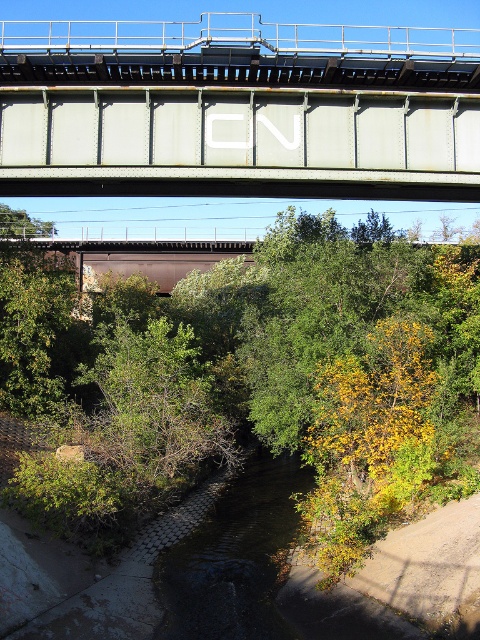
Question: Is green leafy tree at center below rusty metal bridge at upper center?

Choices:
 (A) no
 (B) yes

Answer: (B)

Question: Which of the following is the closest to the observer?

Choices:
 (A) (183, 364)
 (B) (31, 108)

Answer: (B)

Question: In this image, where is green leafy tree at center located relative to rusty metal bridge at upper center?

Choices:
 (A) above
 (B) below

Answer: (B)

Question: Which of the following is the farthest from the observer?

Choices:
 (A) (64, 300)
 (B) (139, 48)

Answer: (A)

Question: Is green leafy tree at center wider than rusty metal bridge at upper center?

Choices:
 (A) yes
 (B) no

Answer: (B)

Question: Among these objects, which one is nearest to the camera?

Choices:
 (A) rusty metal bridge at upper center
 (B) green leafy tree at center

Answer: (A)